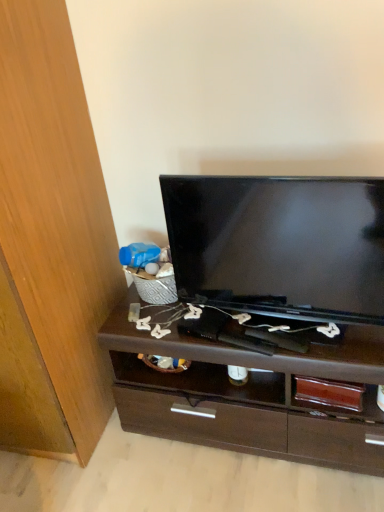
At what (x,y) coordinates should I click in order to perform the action: click on free point above dark brown wood chest of drawers at center (from a real-world perspective). Please return your answer as a coordinate pair (x, y). This screenshot has height=512, width=384. Looking at the image, I should click on (222, 330).